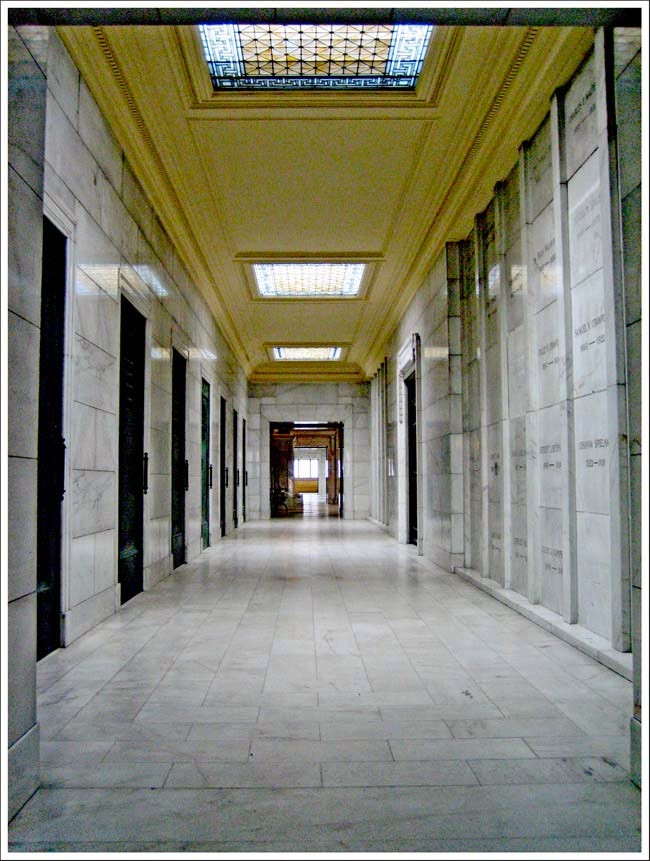
Identify the location of doorways. (183, 479), (134, 486), (36, 465), (205, 473), (311, 472), (248, 478), (237, 480), (224, 480), (413, 467).